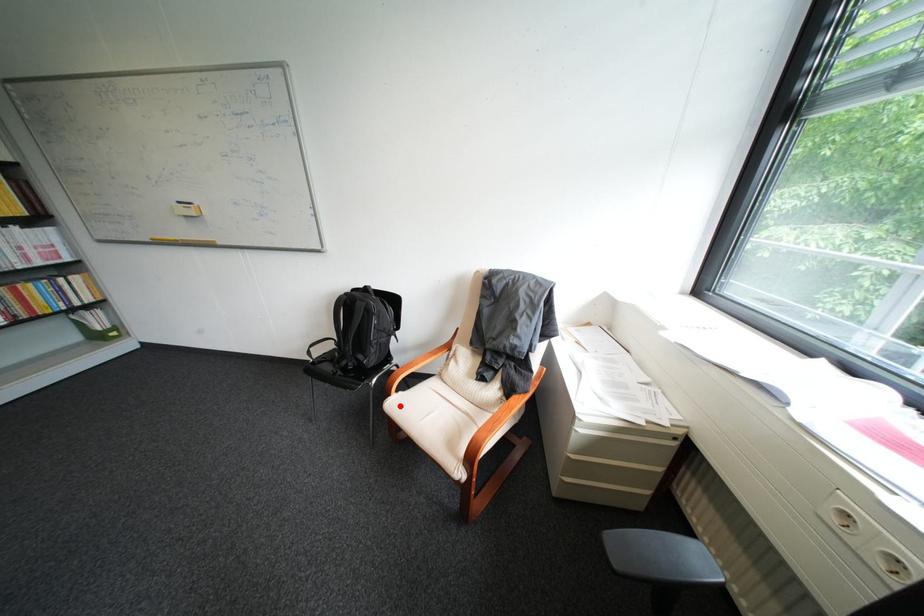
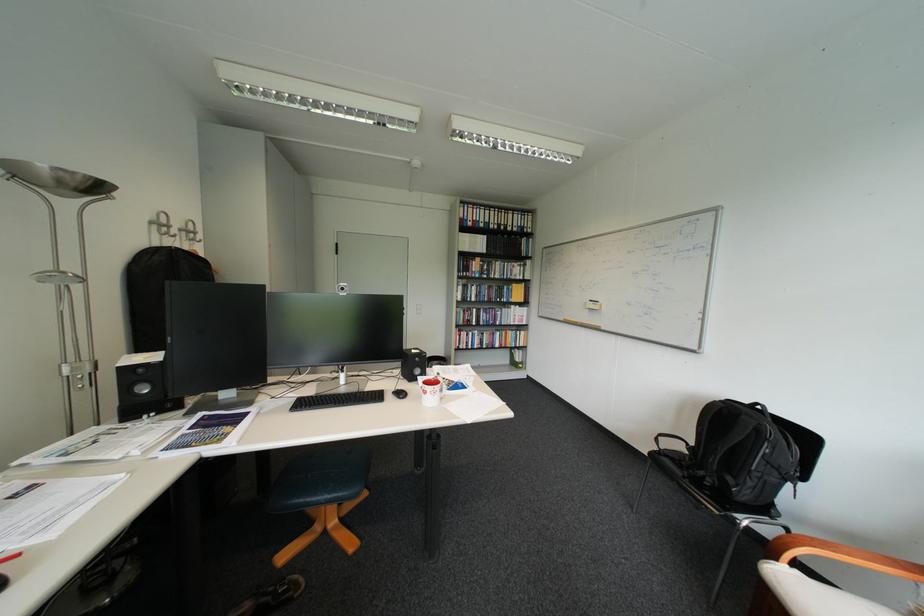
Question: I am providing you with two images of the same scene from different viewpoints. A red point is marked on the first image. Is the red point's position out of view in image 2?

Choices:
 (A) Yes
 (B) No

Answer: (B)